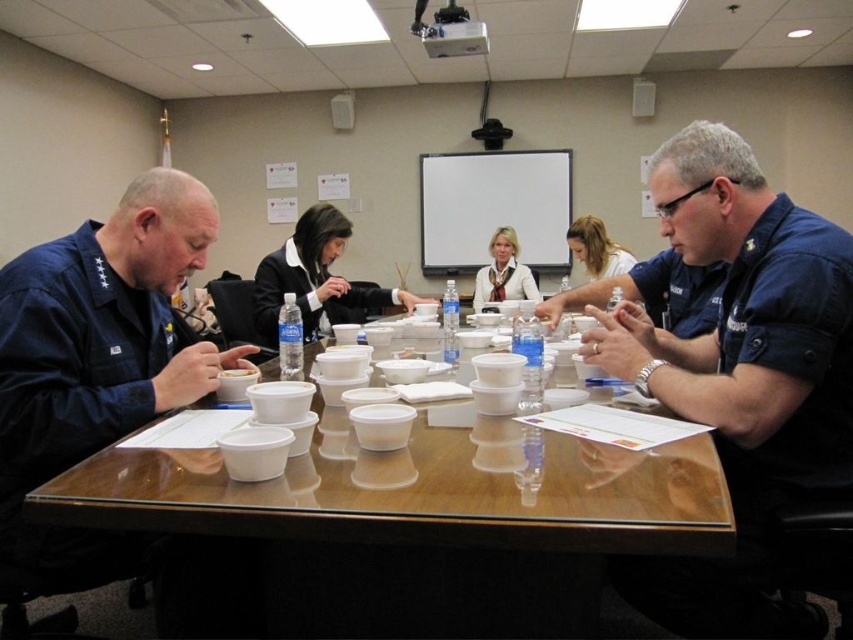
Question: Is wooden table at center wider than black fabric jacket at center?

Choices:
 (A) yes
 (B) no

Answer: (A)

Question: Is wooden table at center below blonde hair at upper center?

Choices:
 (A) no
 (B) yes

Answer: (B)

Question: Which object is the closest to the blonde hair at upper center?

Choices:
 (A) black fabric jacket at center
 (B) wooden table at center
 (C) matte white blouse at center

Answer: (C)

Question: Does black fabric jacket at center have a lesser width compared to matte white blouse at center?

Choices:
 (A) yes
 (B) no

Answer: (B)

Question: Which object is the closest to the matte white blouse at center?

Choices:
 (A) blonde hair at upper center
 (B) black fabric jacket at center
 (C) wooden table at center

Answer: (A)

Question: Considering the real-world distances, which object is closest to the black fabric jacket at center?

Choices:
 (A) blonde hair at upper center
 (B) wooden table at center
 (C) matte white blouse at center

Answer: (A)